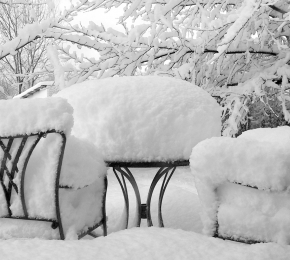
I want to click on chairs, so click(x=20, y=186), click(x=254, y=187).